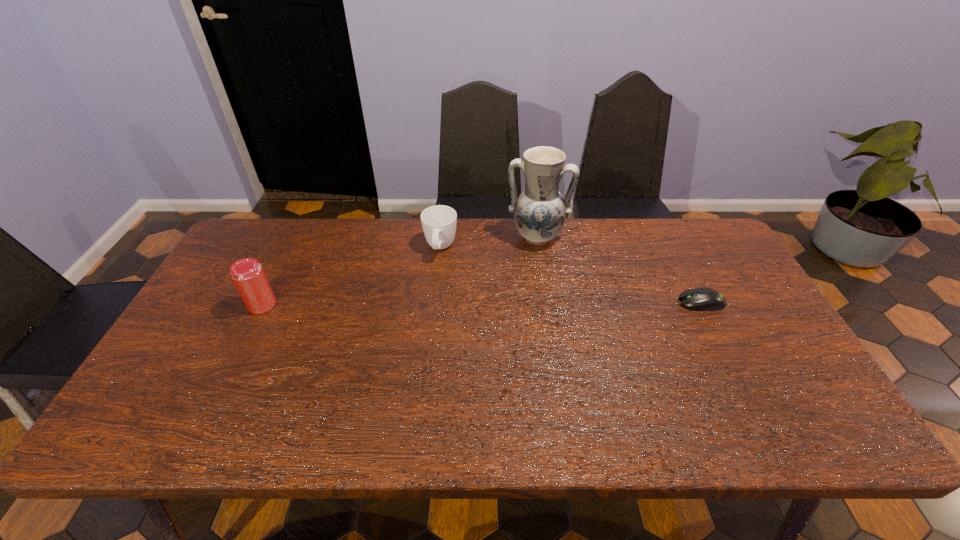
You are a GUI agent. You are given a task and a screenshot of the screen. Output one action in this format:
    pyautogui.click(x=<x>, y=<y>)
    Task: Click on the free spot that satisfies the following two spatial constraints: 1. on the back side of the second tallest object; 2. on the left side of the third object from right to left
    This screenshot has height=540, width=960.
    Given the screenshot: What is the action you would take?
    pyautogui.click(x=290, y=248)

Find the location of a particular element. free spot that satisfies the following two spatial constraints: 1. on the front side of the shortest object; 2. on the wheel side of the pottery is located at coordinates (546, 302).

Locate an element on the screen. free point that satisfies the following two spatial constraints: 1. on the back side of the rightmost object; 2. on the wheel side of the leftmost object is located at coordinates (263, 302).

Locate an element on the screen. free space that satisfies the following two spatial constraints: 1. on the front side of the pottery; 2. on the wheel side of the shortest object is located at coordinates (546, 302).